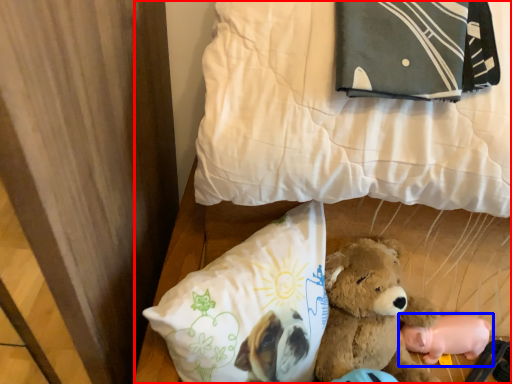
Question: Which object appears closest to the camera in this image, bed (highlighted by a red box) or toy (highlighted by a blue box)?

Choices:
 (A) bed
 (B) toy

Answer: (A)